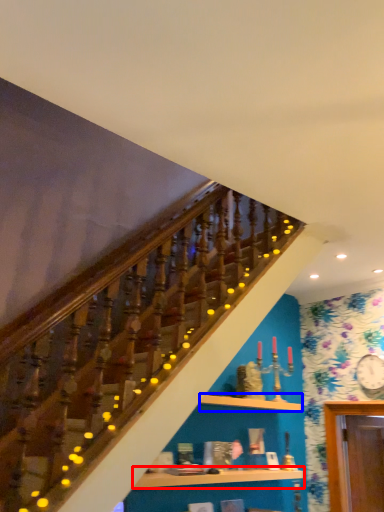
Question: Among these objects, which one is farthest to the camera, shelf (highlighted by a red box) or shelf (highlighted by a blue box)?

Choices:
 (A) shelf
 (B) shelf

Answer: (B)